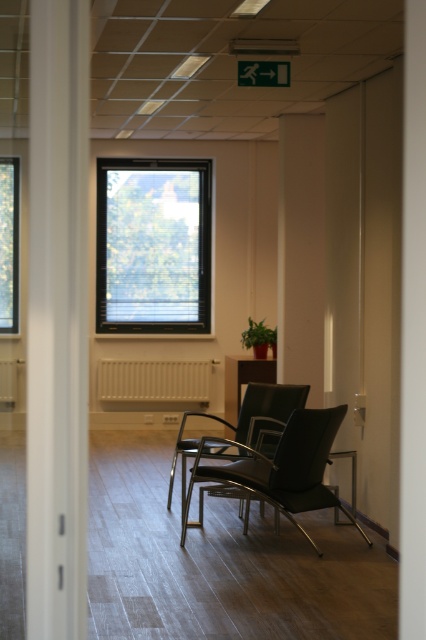
You are an office worker who needs to choose between two chairs in the corridor for a meeting. The chairs are the black leather armchair at center and the matte black armchair at center. Which chair is taller?

The matte black armchair at center is taller than the black leather armchair at center.

You are a delivery person entering the hallway and need to place a large package on the floor between the transparent glass window at center and the white matte radiator at center. Can you walk straight ahead to place it there without needing to move either object?

The transparent glass window at center is closer to the viewer than the white matte radiator at center, so you can walk straight ahead towards the transparent glass window at center and place the package between them without needing to move either object.